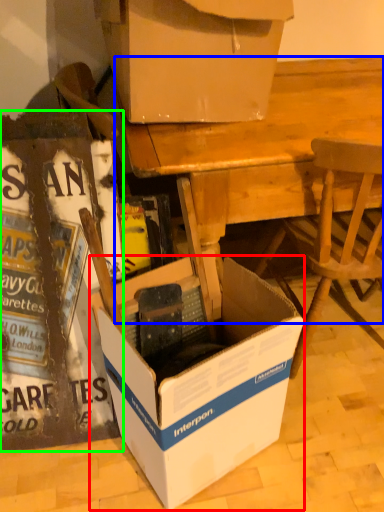
Question: Which object is the farthest from box (highlighted by a red box)? Choose among these: desk (highlighted by a blue box) or box (highlighted by a green box).

Choices:
 (A) desk
 (B) box

Answer: (A)